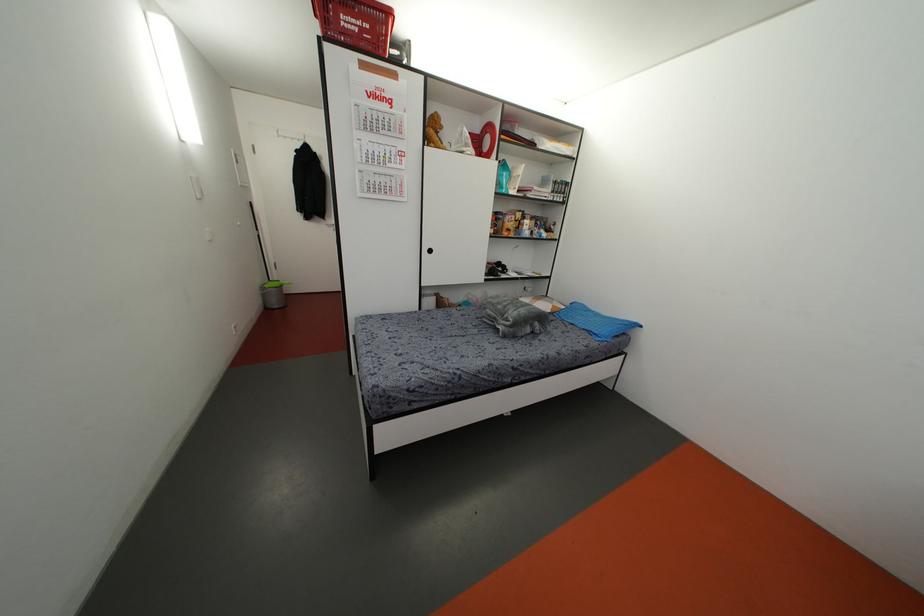
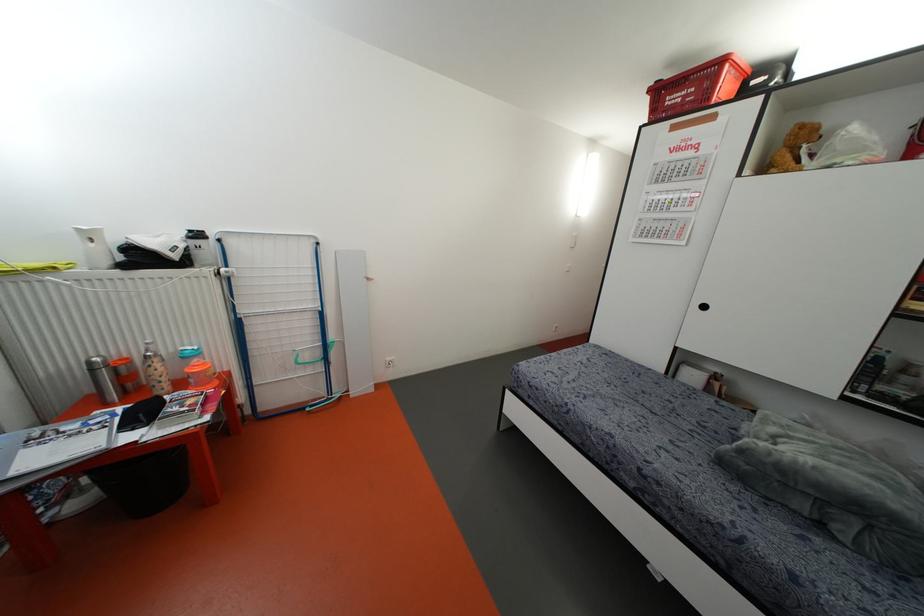
Locate, in the second image, the point that corresponds to (436,132) in the first image.

(796, 150)